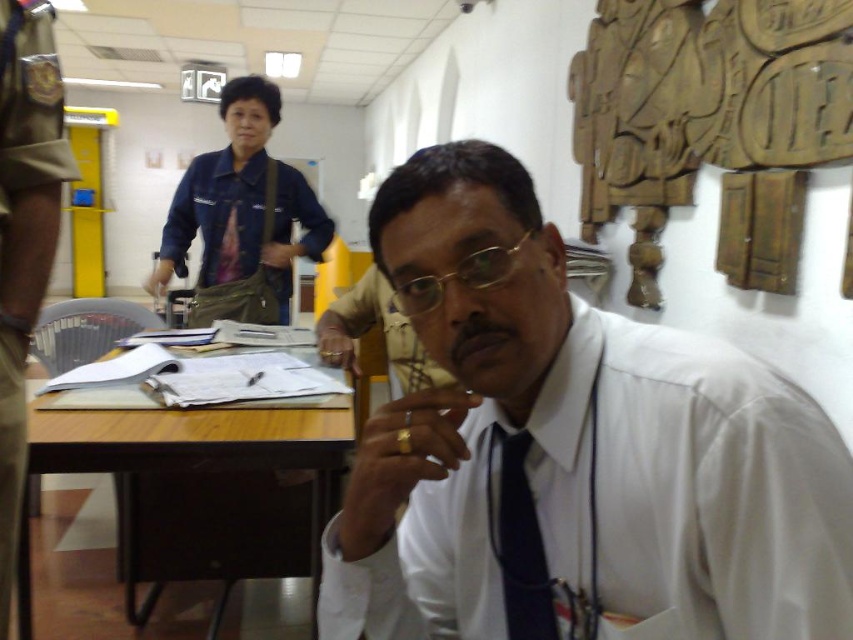
You are an office assistant who needs to retrieve the black silk tie at center for a meeting. The denim jacket at upper left is blocking the path. Can you move the jacket to access the tie?

The black silk tie at center is behind the denim jacket at upper left, so you can move the denim jacket at upper left to access the tie.

You are a photographer trying to capture a portrait of the man in the white glossy shirt at center. You have a camera that requires a minimum distance of 50 centimeters to focus properly. Can you stand at your current position and take the photo without moving closer?

The distance between the white glossy shirt at center and the camera is 53.17 centimeters, which is greater than the minimum required 50 centimeters. Therefore, you can take the photo without moving closer.